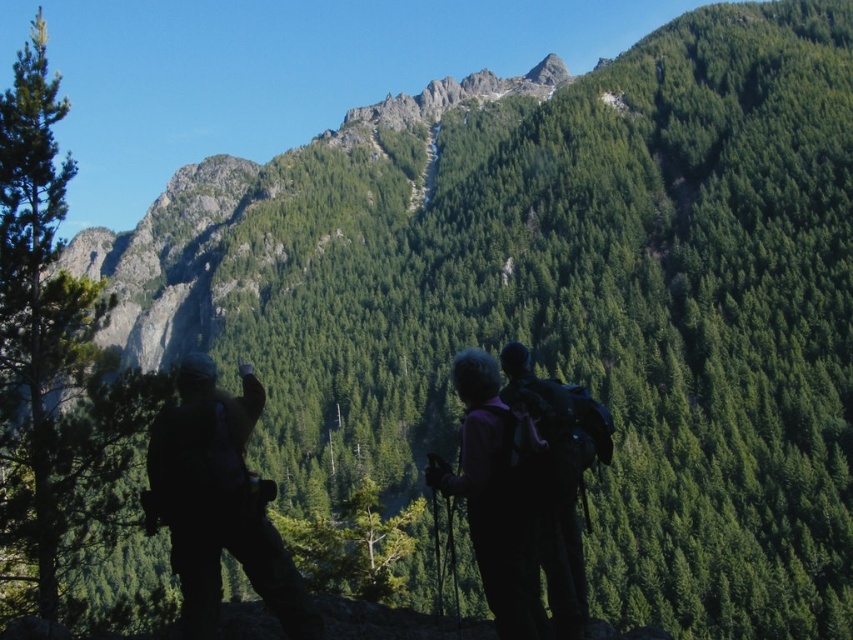
Question: Estimate the real-world distances between objects in this image. Which object is closer to the green textured tree at left?

Choices:
 (A) silhouette backpack at left
 (B) purple fabric backpack at center

Answer: (A)

Question: Among these points, which one is farthest from the camera?

Choices:
 (A) pos(277,618)
 (B) pos(131,410)

Answer: (B)

Question: Considering the relative positions of green textured tree at left and silhouette backpack at left in the image provided, where is green textured tree at left located with respect to silhouette backpack at left?

Choices:
 (A) below
 (B) above

Answer: (B)

Question: Which point is farther to the camera?

Choices:
 (A) purple fabric backpack at center
 (B) green textured tree at left
 (C) silhouette backpack at left

Answer: (B)

Question: Observing the image, what is the correct spatial positioning of green textured tree at left in reference to silhouette backpack at left?

Choices:
 (A) above
 (B) below

Answer: (A)

Question: Does silhouette backpack at left appear on the right side of purple fabric backpack at center?

Choices:
 (A) yes
 (B) no

Answer: (B)